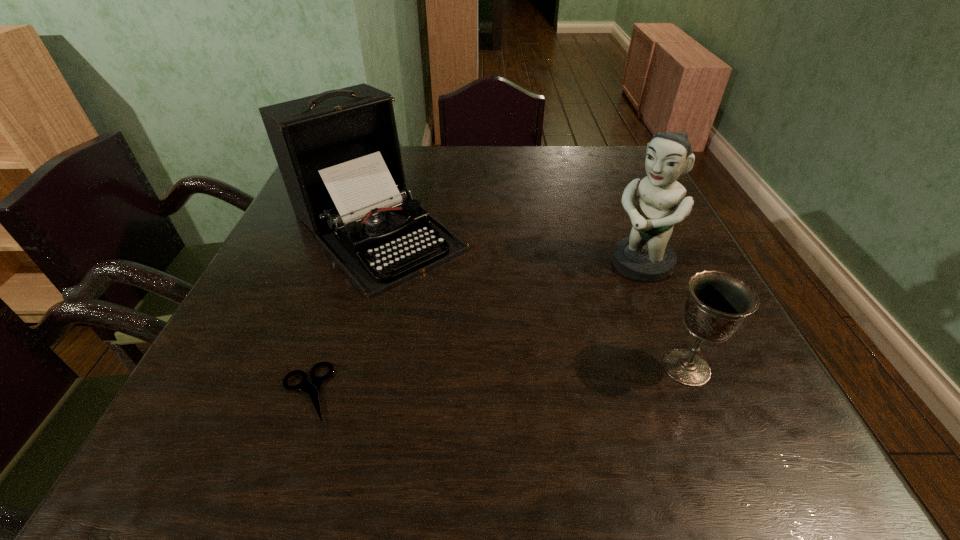
Find the location of a particular element. This screenshot has width=960, height=540. free spot on the desktop that is between the shortest object and the chalice and is positioned inside the open case of the typewriter is located at coordinates coord(533,377).

The width and height of the screenshot is (960, 540). I want to click on free space on the desktop that is between the shortest object and the third tallest object and is positioned on the front-facing side of the figurine, so click(x=499, y=380).